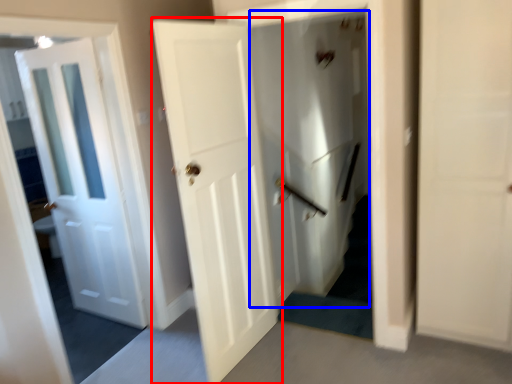
Question: Which object is closer to the camera taking this photo, door (highlighted by a red box) or elevator (highlighted by a blue box)?

Choices:
 (A) door
 (B) elevator

Answer: (A)